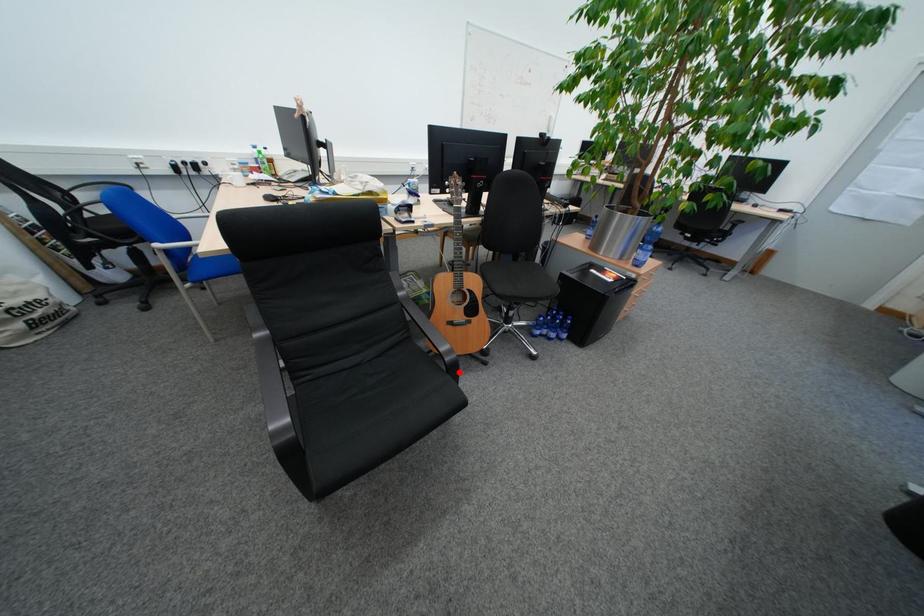
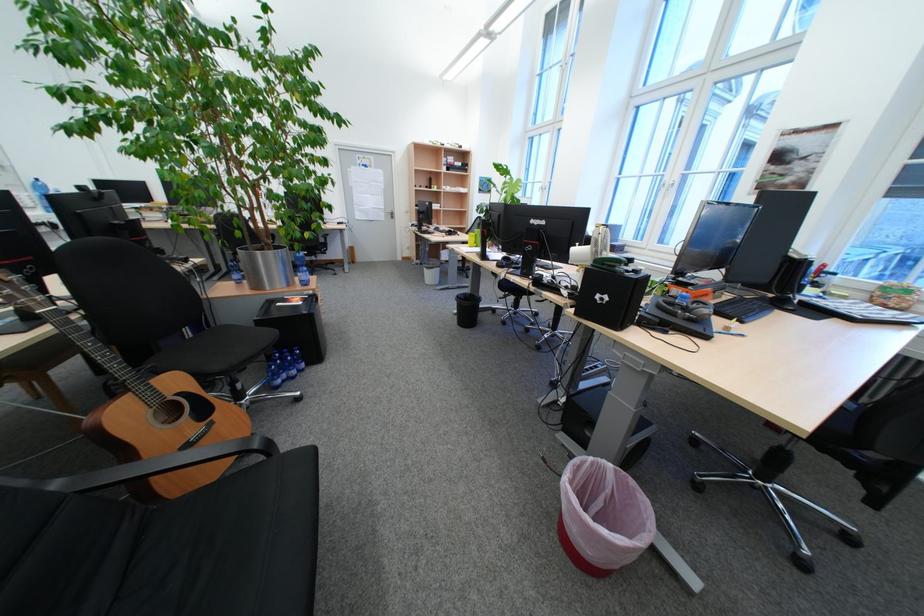
Question: A red point is marked in image1. In image2, is the corresponding 3D point closer to the camera or farther? Reply with the corresponding letter.

Choices:
 (A) The corresponding 3D point is closer.
 (B) The corresponding 3D point is farther.

Answer: (A)